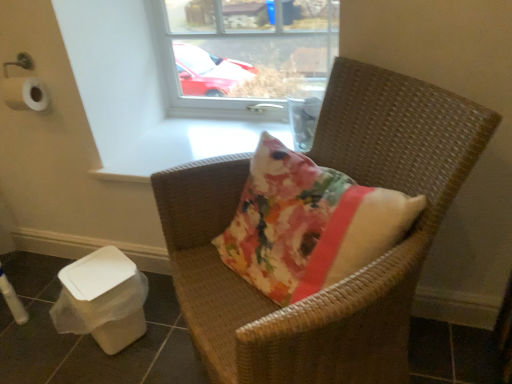
Question: Is transparent glass window at upper center positioned with its back to woven brown chair at center?

Choices:
 (A) no
 (B) yes

Answer: (A)

Question: From a real-world perspective, is transparent glass window at upper center located higher than woven brown chair at center?

Choices:
 (A) no
 (B) yes

Answer: (B)

Question: Does transparent glass window at upper center have a larger size compared to woven brown chair at center?

Choices:
 (A) no
 (B) yes

Answer: (A)

Question: Can woven brown chair at center be found inside transparent glass window at upper center?

Choices:
 (A) yes
 (B) no

Answer: (B)

Question: Does transparent glass window at upper center appear on the right side of woven brown chair at center?

Choices:
 (A) yes
 (B) no

Answer: (B)

Question: Is transparent glass window at upper center to the left or to the right of woven brown chair at center in the image?

Choices:
 (A) left
 (B) right

Answer: (A)

Question: From the image's perspective, is transparent glass window at upper center positioned above or below woven brown chair at center?

Choices:
 (A) below
 (B) above

Answer: (B)

Question: Would you say transparent glass window at upper center is inside or outside woven brown chair at center?

Choices:
 (A) inside
 (B) outside

Answer: (B)

Question: From a real-world perspective, is transparent glass window at upper center physically located above or below woven brown chair at center?

Choices:
 (A) above
 (B) below

Answer: (A)

Question: In terms of width, does white plastic potty at lower left look wider or thinner when compared to transparent glass window at upper center?

Choices:
 (A) wide
 (B) thin

Answer: (A)

Question: Is point (66, 292) closer or farther from the camera than point (226, 89)?

Choices:
 (A) farther
 (B) closer

Answer: (B)

Question: From the image's perspective, relative to transparent glass window at upper center, is white plastic potty at lower left above or below?

Choices:
 (A) above
 (B) below

Answer: (B)

Question: Considering their positions, is white plastic potty at lower left located in front of or behind transparent glass window at upper center?

Choices:
 (A) front
 (B) behind

Answer: (A)

Question: Is white plastic potty at lower left wider or thinner than woven brown chair at center?

Choices:
 (A) thin
 (B) wide

Answer: (A)

Question: In terms of height, does white plastic potty at lower left look taller or shorter compared to woven brown chair at center?

Choices:
 (A) short
 (B) tall

Answer: (A)